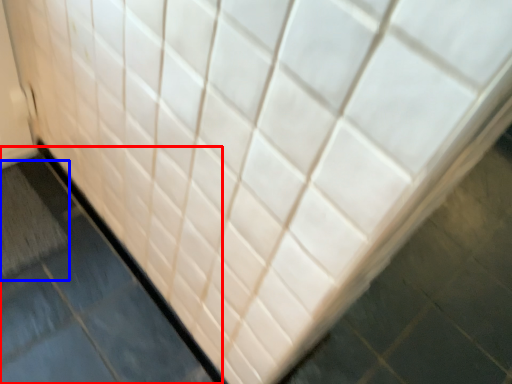
Question: Which object appears closest to the camera in this image, slate (highlighted by a red box) or bath mat (highlighted by a blue box)?

Choices:
 (A) slate
 (B) bath mat

Answer: (A)